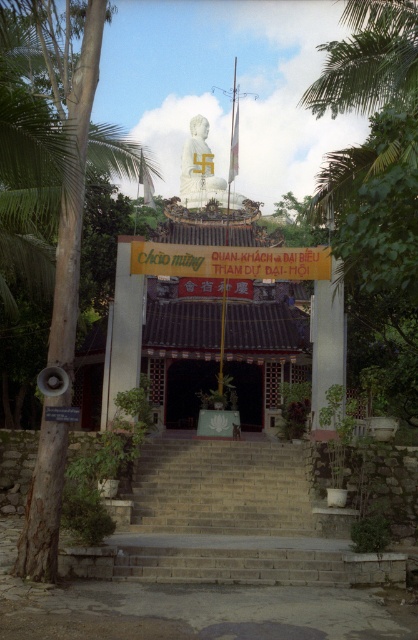
Which is behind, point (28, 490) or point (185, 180)?

Positioned behind is point (185, 180).

Does point (22, 3) lie behind point (180, 188)?

No.

At what (x,y) coordinates should I click in order to perform the action: click on brown wood tree at left. Please return your answer as a coordinate pair (x, y). Looking at the image, I should click on (69, 156).

Is point (158, 548) more distant than point (239, 200)?

No, it is not.

Between point (162, 484) and point (198, 115), which one is positioned in front?

Point (162, 484) is in front.

Which is behind, point (234, 552) or point (198, 193)?

Positioned behind is point (198, 193).

The width and height of the screenshot is (418, 640). I want to click on stone stairs at center, so pyautogui.click(x=231, y=522).

Who is more forward, (259,557) or (132,172)?

Point (259,557)

Between stone stairs at center and brown wood tree at left, which one has more height?

brown wood tree at left

Who is more forward, (252, 451) or (38, 464)?

Point (38, 464) is more forward.

The image size is (418, 640). I want to click on stone stairs at center, so click(231, 522).